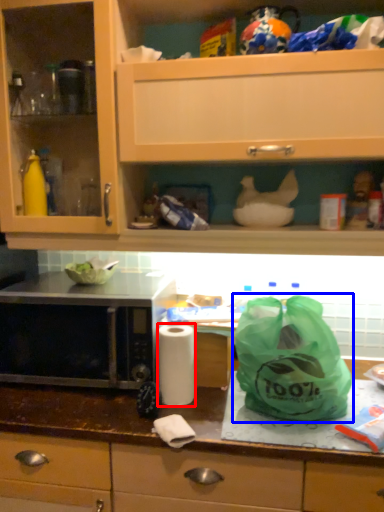
Question: Which of the following is the closest to the observer, paper towel (highlighted by a red box) or plastic bag (highlighted by a blue box)?

Choices:
 (A) paper towel
 (B) plastic bag

Answer: (B)